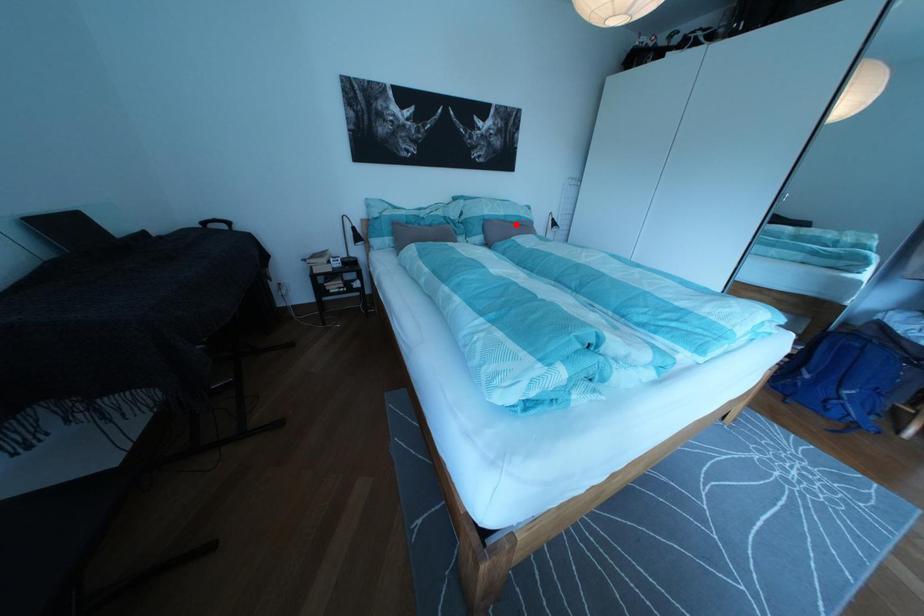
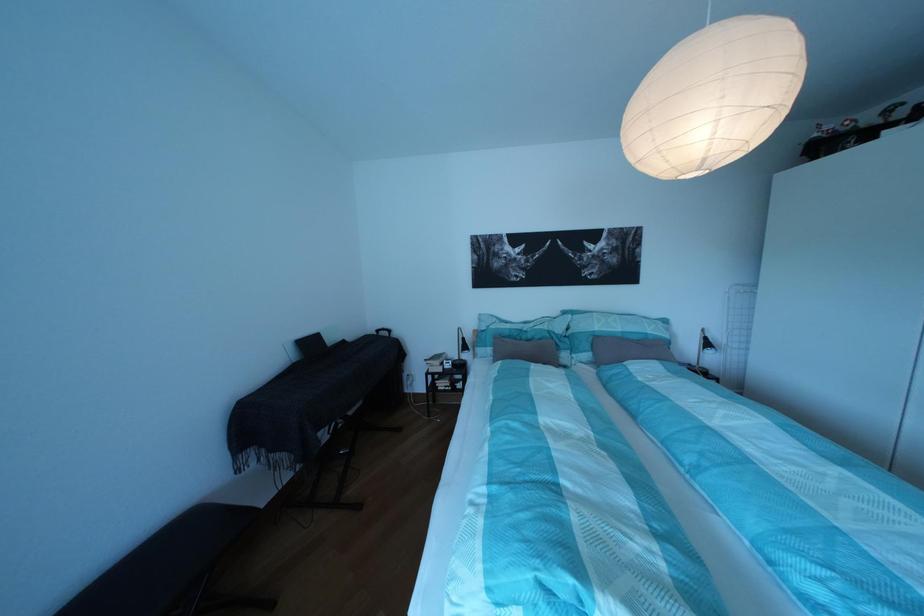
Where in the second image is the point corresponding to the highlighted location from the first image?

(633, 341)